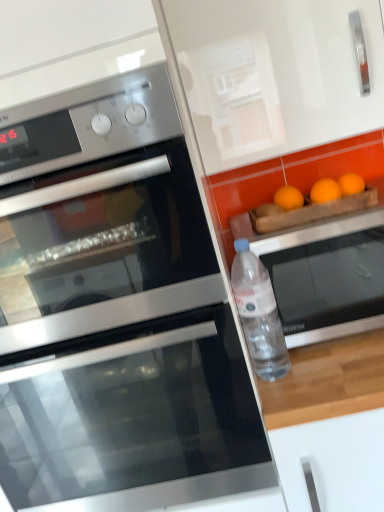
Question: Could you tell me if stainless steel oven at lower left, which ranks as the second oven in left-to-right order, is turned towards stainless steel oven at left, which appears as the 3th oven when viewed from the right?

Choices:
 (A) yes
 (B) no

Answer: (B)

Question: Is there a large distance between stainless steel oven at lower left, which ranks as the second oven in left-to-right order, and stainless steel oven at left, which ranks as the 1th oven in left-to-right order?

Choices:
 (A) yes
 (B) no

Answer: (B)

Question: Considering the relative sizes of stainless steel oven at lower left, which ranks as the second oven in left-to-right order, and stainless steel oven at left, which appears as the 3th oven when viewed from the right, in the image provided, is stainless steel oven at lower left, which ranks as the second oven in left-to-right order, taller than stainless steel oven at left, which appears as the 3th oven when viewed from the right,?

Choices:
 (A) yes
 (B) no

Answer: (A)

Question: Is stainless steel oven at lower left, which ranks as the second oven in left-to-right order, positioned with its back to stainless steel oven at left, which ranks as the 1th oven in left-to-right order?

Choices:
 (A) yes
 (B) no

Answer: (B)

Question: Would you say stainless steel oven at left, which ranks as the 1th oven in left-to-right order, is part of stainless steel oven at lower left, which ranks as the second oven in left-to-right order,'s contents?

Choices:
 (A) yes
 (B) no

Answer: (B)

Question: Choose the correct answer: Is stainless steel oven at right, the 3th oven positioned from the left, inside transparent plastic bottle at right or outside it?

Choices:
 (A) outside
 (B) inside

Answer: (A)

Question: Is stainless steel oven at right, the 3th oven positioned from the left, to the left or to the right of transparent plastic bottle at right in the image?

Choices:
 (A) left
 (B) right

Answer: (B)

Question: In terms of size, does stainless steel oven at right, which is the first oven in right-to-left order, appear bigger or smaller than transparent plastic bottle at right?

Choices:
 (A) big
 (B) small

Answer: (A)

Question: From the image's perspective, relative to transparent plastic bottle at right, is stainless steel oven at right, the 3th oven positioned from the left, above or below?

Choices:
 (A) below
 (B) above

Answer: (B)

Question: From a real-world perspective, is stainless steel oven at lower left, which is counted as the second oven, starting from the right, above or below transparent plastic bottle at right?

Choices:
 (A) above
 (B) below

Answer: (B)

Question: Relative to transparent plastic bottle at right, is stainless steel oven at lower left, which ranks as the second oven in left-to-right order, in front or behind?

Choices:
 (A) behind
 (B) front

Answer: (B)

Question: Considering the positions of stainless steel oven at lower left, which ranks as the second oven in left-to-right order, and transparent plastic bottle at right in the image, is stainless steel oven at lower left, which ranks as the second oven in left-to-right order, wider or thinner than transparent plastic bottle at right?

Choices:
 (A) thin
 (B) wide

Answer: (B)

Question: Considering the positions of stainless steel oven at lower left, which is counted as the second oven, starting from the right, and transparent plastic bottle at right in the image, is stainless steel oven at lower left, which is counted as the second oven, starting from the right, bigger or smaller than transparent plastic bottle at right?

Choices:
 (A) small
 (B) big

Answer: (B)

Question: Considering the relative positions of stainless steel oven at left, which ranks as the 1th oven in left-to-right order, and stainless steel oven at right, which is the first oven in right-to-left order, in the image provided, is stainless steel oven at left, which ranks as the 1th oven in left-to-right order, to the left or to the right of stainless steel oven at right, which is the first oven in right-to-left order,?

Choices:
 (A) right
 (B) left

Answer: (B)

Question: From a real-world perspective, is stainless steel oven at left, which ranks as the 1th oven in left-to-right order, positioned above or below stainless steel oven at right, which is the first oven in right-to-left order?

Choices:
 (A) below
 (B) above

Answer: (B)